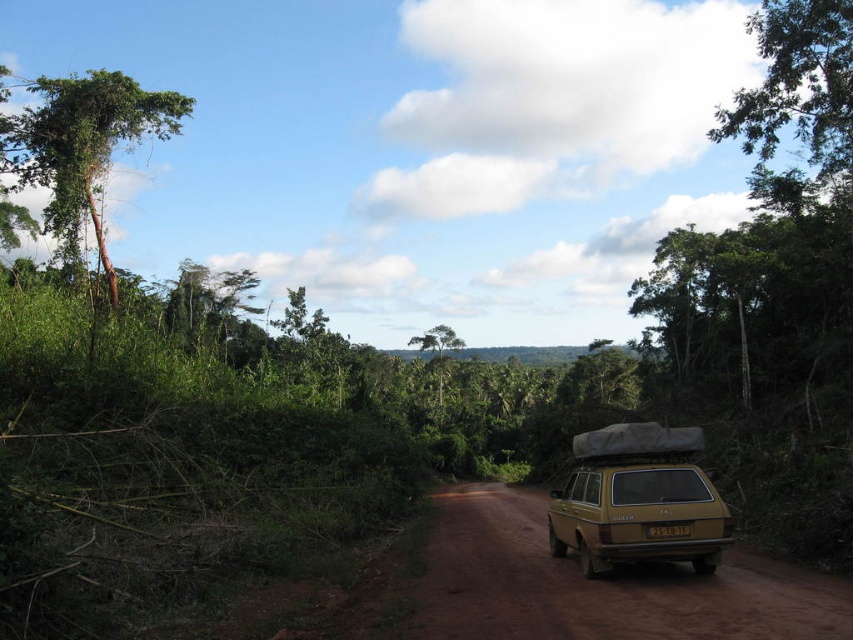
Is point (193, 99) behind point (717, 138)?

Yes, point (193, 99) is behind point (717, 138).

Who is higher up, green leafy tree at left or green leafy tree at upper right?

green leafy tree at upper right is above.

Which is behind, point (123, 136) or point (834, 157)?

Point (123, 136)

Identify the location of green leafy tree at left. Image resolution: width=853 pixels, height=640 pixels. (85, 145).

Is green leafy tree at upper right bigger than green leafy tree at center?

Yes.

Does green leafy tree at upper right have a greater width compared to green leafy tree at center?

Yes, green leafy tree at upper right is wider than green leafy tree at center.

At what (x,y) coordinates should I click in order to perform the action: click on green leafy tree at upper right. Please return your answer as a coordinate pair (x, y). The height and width of the screenshot is (640, 853). Looking at the image, I should click on (798, 84).

Is point (834, 68) positioned before point (612, 483)?

No, (834, 68) is behind (612, 483).

Does green leafy tree at upper right come in front of gold matte station wagon at center?

No, green leafy tree at upper right is behind gold matte station wagon at center.

Does point (851, 65) lie in front of point (601, 528)?

That is False.

Locate an element on the screen. green leafy tree at upper right is located at coordinates (798, 84).